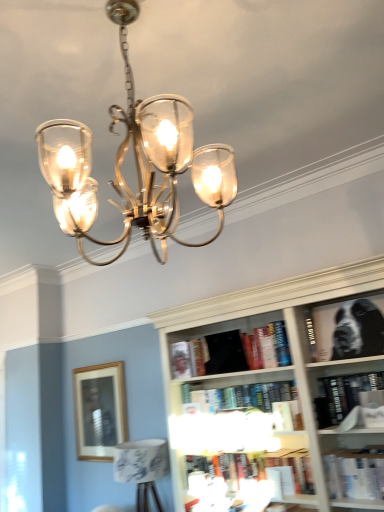
Question: From the image's perspective, is black matte bookshelf at upper right, positioned as the first book in top-to-bottom order, over hardcover book at center, acting as the 4th book starting from the top?

Choices:
 (A) yes
 (B) no

Answer: (A)

Question: Does black matte bookshelf at upper right, placed as the seventh book when sorted from bottom to top, appear on the left side of hardcover book at center, acting as the 4th book starting from the top?

Choices:
 (A) yes
 (B) no

Answer: (A)

Question: Considering the relative sizes of black matte bookshelf at upper right, placed as the seventh book when sorted from bottom to top, and hardcover book at center, acting as the 4th book starting from the top, in the image provided, is black matte bookshelf at upper right, placed as the seventh book when sorted from bottom to top, wider than hardcover book at center, acting as the 4th book starting from the top,?

Choices:
 (A) no
 (B) yes

Answer: (A)

Question: From a real-world perspective, is black matte bookshelf at upper right, placed as the seventh book when sorted from bottom to top, below hardcover book at center, which appears as the 4th book when ordered from the bottom?

Choices:
 (A) no
 (B) yes

Answer: (A)

Question: Does black matte bookshelf at upper right, placed as the seventh book when sorted from bottom to top, have a lesser height compared to hardcover book at center, acting as the 4th book starting from the top?

Choices:
 (A) no
 (B) yes

Answer: (A)

Question: Is hardcover book at center, which ranks as the 3th book in top-to-bottom order, inside or outside of hardcover book at center, which ranks as the 3th book in bottom-to-top order?

Choices:
 (A) inside
 (B) outside

Answer: (B)

Question: In the image, is hardcover book at center, marked as the 5th book in a bottom-to-top arrangement, positioned in front of or behind hardcover book at center, which ranks as the 3th book in bottom-to-top order?

Choices:
 (A) behind
 (B) front

Answer: (A)

Question: Based on their positions, is hardcover book at center, which ranks as the 3th book in top-to-bottom order, located to the left or right of hardcover book at center, the 5th book viewed from the top?

Choices:
 (A) left
 (B) right

Answer: (A)

Question: In terms of size, does hardcover book at center, marked as the 5th book in a bottom-to-top arrangement, appear bigger or smaller than hardcover book at center, which ranks as the 3th book in bottom-to-top order?

Choices:
 (A) small
 (B) big

Answer: (A)

Question: In terms of height, does black matte book at center, the second book when ordered from top to bottom, look taller or shorter compared to polished brass chandelier at upper center?

Choices:
 (A) tall
 (B) short

Answer: (B)

Question: Is black matte book at center, arranged as the 6th book when ordered from the bottom, spatially inside polished brass chandelier at upper center, or outside of it?

Choices:
 (A) outside
 (B) inside

Answer: (A)

Question: From the image's perspective, is black matte book at center, the second book when ordered from top to bottom, positioned above or below polished brass chandelier at upper center?

Choices:
 (A) above
 (B) below

Answer: (B)

Question: Considering their positions, is black matte book at center, arranged as the 6th book when ordered from the bottom, located in front of or behind polished brass chandelier at upper center?

Choices:
 (A) behind
 (B) front

Answer: (A)

Question: Do you think hardcover book at lower center, which is the 7th book from top to bottom, is within hardcover book at center, which appears as the 4th book when ordered from the bottom, or outside of it?

Choices:
 (A) outside
 (B) inside

Answer: (A)

Question: Is hardcover book at lower center, which is the 7th book from top to bottom, bigger or smaller than hardcover book at center, which appears as the 4th book when ordered from the bottom?

Choices:
 (A) small
 (B) big

Answer: (B)